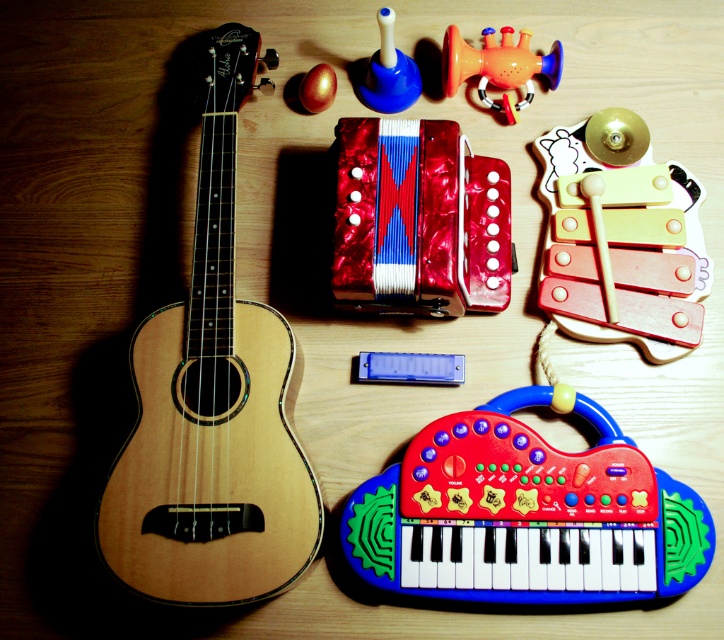
Question: Which of these objects is positioned closest to the natural wood guitar at left?

Choices:
 (A) rubberized plastic trumpet at upper right
 (B) rubberized plastic keyboard at bottom center
 (C) blue plastic whistle at upper center

Answer: (B)

Question: Which point is closer to the camera?

Choices:
 (A) wooden xylophone at upper right
 (B) rubberized plastic trumpet at upper right
 (C) natural wood guitar at left
 (D) blue plastic whistle at upper center

Answer: (C)

Question: Does wooden xylophone at upper right come in front of shiny red pearlized accordion at upper center?

Choices:
 (A) yes
 (B) no

Answer: (B)

Question: Is shiny red pearlized accordion at upper center bigger than blue plastic whistle at upper center?

Choices:
 (A) no
 (B) yes

Answer: (B)

Question: Does natural wood guitar at left have a smaller size compared to wooden xylophone at upper right?

Choices:
 (A) yes
 (B) no

Answer: (B)

Question: Estimate the real-world distances between objects in this image. Which object is closer to the rubberized plastic trumpet at upper right?

Choices:
 (A) shiny red pearlized accordion at upper center
 (B) wooden xylophone at upper right
 (C) blue plastic whistle at upper center
 (D) rubberized plastic keyboard at bottom center

Answer: (C)